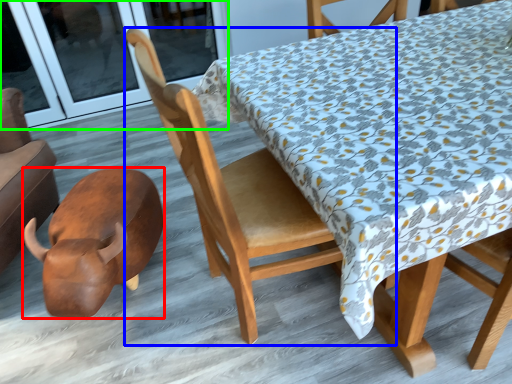
Question: Which object is positioned farthest from animal (highlighted by a red box)? Select from chair (highlighted by a blue box) and screen door (highlighted by a green box).

Choices:
 (A) chair
 (B) screen door

Answer: (B)